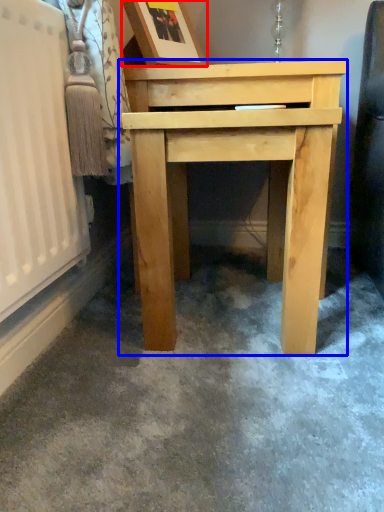
Question: Which object appears farthest to the camera in this image, picture frame (highlighted by a red box) or table (highlighted by a blue box)?

Choices:
 (A) picture frame
 (B) table

Answer: (A)